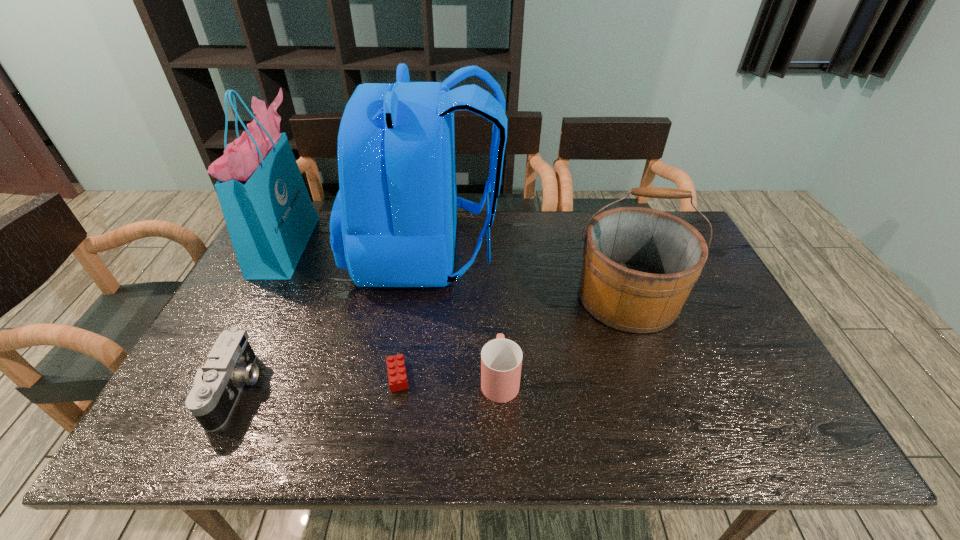
Locate an element on the screen. The height and width of the screenshot is (540, 960). backpack is located at coordinates (393, 223).

Where is `shopping bag`? shopping bag is located at coordinates (270, 217).

Find the location of a particular element. This screenshot has height=540, width=960. the fourth shortest object is located at coordinates (639, 265).

This screenshot has height=540, width=960. Find the location of `the rightmost object`. the rightmost object is located at coordinates (639, 265).

Where is `cup`? cup is located at coordinates (501, 359).

Image resolution: width=960 pixels, height=540 pixels. In order to click on camera in this screenshot , I will do `click(230, 364)`.

Image resolution: width=960 pixels, height=540 pixels. Identify the location of the shortest object. (397, 377).

Identify the location of vacant space located on the back of the backpack. This screenshot has height=540, width=960. 573,252.

At what (x,y) coordinates should I click in order to perform the action: click on free space located 0.090m on the front of the shopping bag. Please return your answer as a coordinate pair (x, y). Looking at the image, I should click on (255, 301).

Identify the location of vacant region located on the back of the rightmost object. (600, 218).